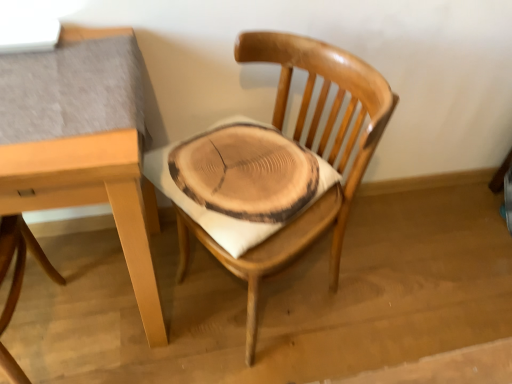
Question: In terms of height, does light brown wood table at upper left look taller or shorter compared to wooden chair at center, placed as the 1th chair when sorted from right to left?

Choices:
 (A) tall
 (B) short

Answer: (B)

Question: In terms of width, does light brown wood table at upper left look wider or thinner when compared to wooden chair at center, placed as the 1th chair when sorted from right to left?

Choices:
 (A) wide
 (B) thin

Answer: (A)

Question: Estimate the real-world distances between objects in this image. Which object is closer to the wooden chair at center, which appears as the second chair when viewed from the left?

Choices:
 (A) natural wood chair at center, positioned as the second chair in right-to-left order
 (B) light brown wood table at upper left

Answer: (B)

Question: Estimate the real-world distances between objects in this image. Which object is farther from the light brown wood table at upper left?

Choices:
 (A) wooden chair at center, placed as the 1th chair when sorted from right to left
 (B) natural wood chair at center, positioned as the second chair in right-to-left order

Answer: (A)